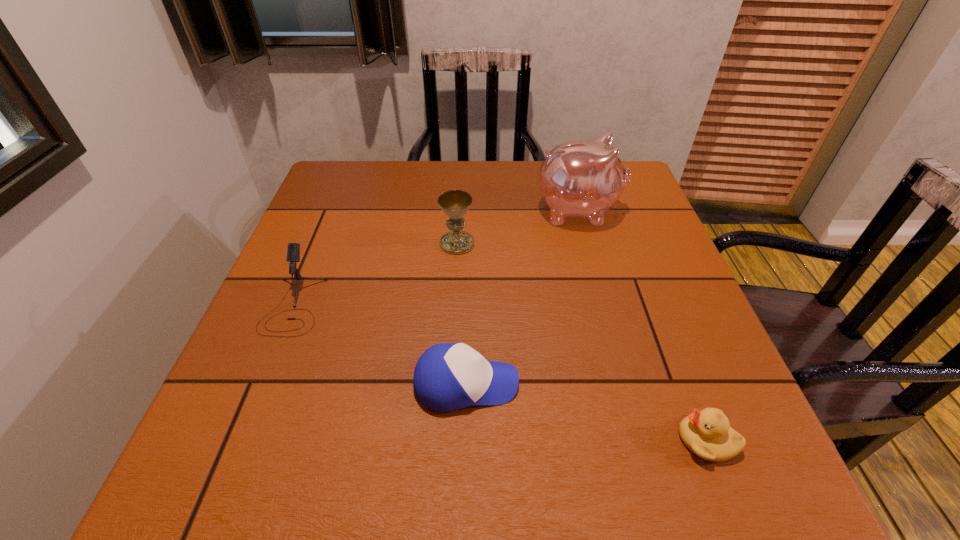
Find the location of a particular element. Image resolution: width=960 pixels, height=540 pixels. vacant space at the far edge of the desktop is located at coordinates (384, 193).

Image resolution: width=960 pixels, height=540 pixels. In order to click on vacant space at the near edge of the desktop in this screenshot , I will do `click(545, 491)`.

Locate an element on the screen. The height and width of the screenshot is (540, 960). vacant space at the left edge of the desktop is located at coordinates (307, 341).

Locate an element on the screen. free spot at the right edge of the desktop is located at coordinates (681, 303).

Where is `vacant space at the near left corner of the desktop`? vacant space at the near left corner of the desktop is located at coordinates (239, 469).

Identify the location of vacant space at the far right corner of the desktop. (628, 195).

The height and width of the screenshot is (540, 960). Identify the location of unoccupied area between the baseball cap and the duckling. (587, 412).

At what (x,y) coordinates should I click in order to perform the action: click on free spot between the baseball cap and the tallest object. Please return your answer as a coordinate pair (x, y). Looking at the image, I should click on (522, 298).

The height and width of the screenshot is (540, 960). Find the location of `vacant area between the duckling and the fourth shortest object`. vacant area between the duckling and the fourth shortest object is located at coordinates (582, 342).

Locate an element on the screen. empty location between the leftmost object and the fourth shortest object is located at coordinates point(375,274).